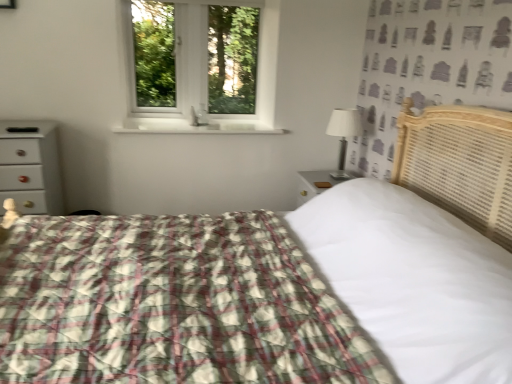
Question: From the image's perspective, is white glossy chest of drawers at left located above or below white plastic window at upper center?

Choices:
 (A) below
 (B) above

Answer: (A)

Question: Is white glossy chest of drawers at left bigger or smaller than white plastic window at upper center?

Choices:
 (A) small
 (B) big

Answer: (B)

Question: Based on their relative distances, which object is farther from the white glossy chest of drawers at left?

Choices:
 (A) plaid fabric bed at center
 (B) white fabric-covered lamp at right
 (C) white glossy window sill at center
 (D) white plastic window at upper center

Answer: (B)

Question: Which is nearer to the white plastic window at upper center?

Choices:
 (A) white glossy chest of drawers at left
 (B) white glossy window sill at center
 (C) white fabric-covered lamp at right
 (D) plaid fabric bed at center

Answer: (B)